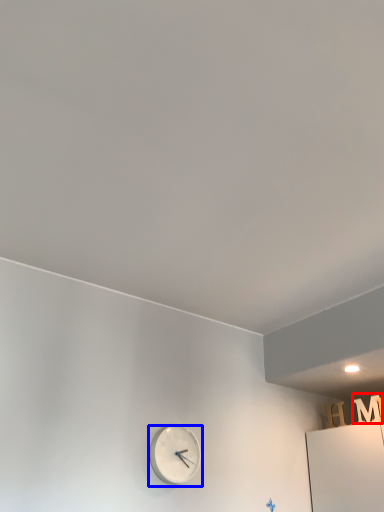
Question: Which of the following is the farthest to the observer, letter (highlighted by a red box) or wall clock (highlighted by a blue box)?

Choices:
 (A) letter
 (B) wall clock

Answer: (A)